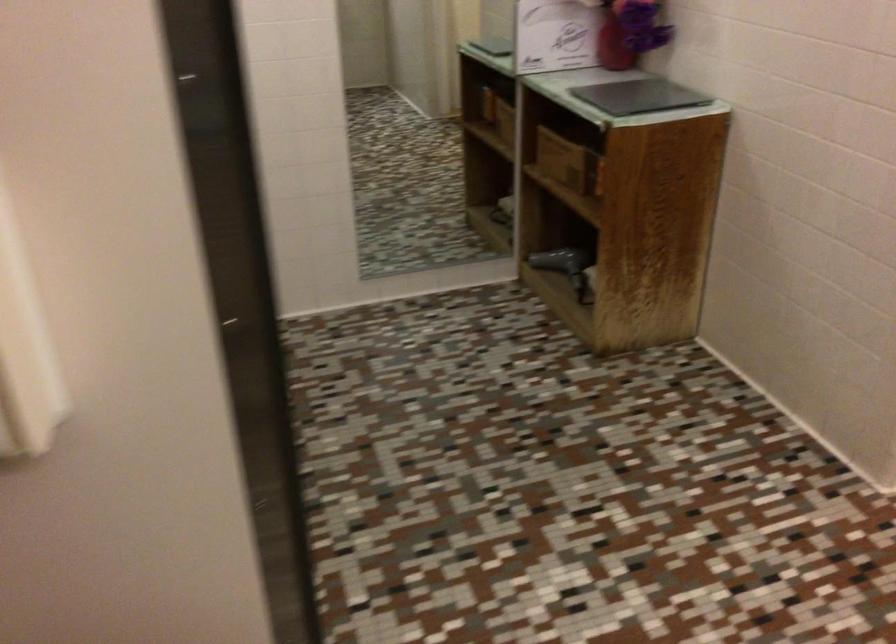
Where is `white box`? This screenshot has height=644, width=896. white box is located at coordinates (556, 35).